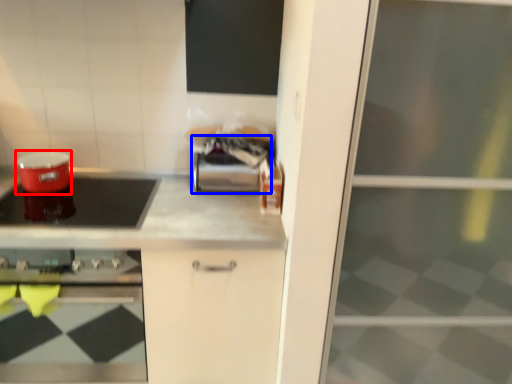
Question: Among these objects, which one is nearest to the camera, appliance (highlighted by a red box) or appliance (highlighted by a blue box)?

Choices:
 (A) appliance
 (B) appliance

Answer: (A)